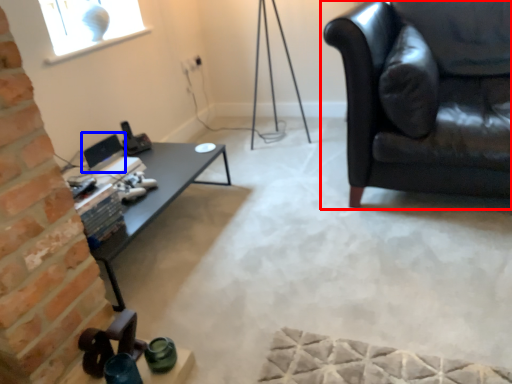
Question: Which object is closer to the camera taking this photo, studio couch (highlighted by a red box) or computer monitor (highlighted by a blue box)?

Choices:
 (A) studio couch
 (B) computer monitor

Answer: (A)